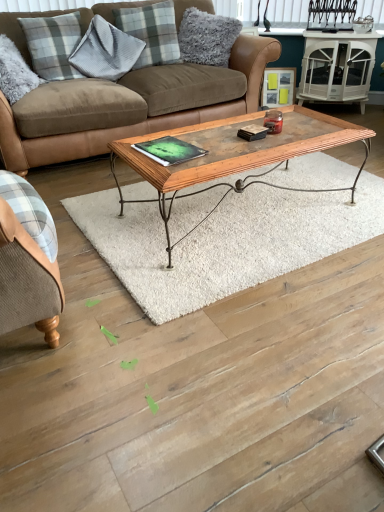
Question: Is brown leather couch at center at the right side of matte wooden picture frame at upper right?

Choices:
 (A) yes
 (B) no

Answer: (B)

Question: From the image's perspective, is brown leather couch at center located above matte wooden picture frame at upper right?

Choices:
 (A) no
 (B) yes

Answer: (A)

Question: Is matte wooden picture frame at upper right at the back of brown leather couch at center?

Choices:
 (A) no
 (B) yes

Answer: (A)

Question: Could you tell me if brown leather couch at center is facing matte wooden picture frame at upper right?

Choices:
 (A) yes
 (B) no

Answer: (B)

Question: Does brown leather couch at center have a greater width compared to matte wooden picture frame at upper right?

Choices:
 (A) no
 (B) yes

Answer: (B)

Question: From the image's perspective, is green matte book at center located above or below gray plaid pillow at upper left, which is counted as the third pillow, starting from the left?

Choices:
 (A) above
 (B) below

Answer: (B)

Question: Based on their sizes in the image, would you say green matte book at center is bigger or smaller than gray plaid pillow at upper left, which appears as the 2th pillow when viewed from the right?

Choices:
 (A) small
 (B) big

Answer: (A)

Question: Which is correct: green matte book at center is inside gray plaid pillow at upper left, which is counted as the third pillow, starting from the left, or outside of it?

Choices:
 (A) inside
 (B) outside

Answer: (B)

Question: Does point (178, 154) appear closer or farther from the camera than point (178, 56)?

Choices:
 (A) farther
 (B) closer

Answer: (B)

Question: Visually, is brown leather couch at center positioned to the left or to the right of gray plaid pillow at upper left, positioned as the first pillow in left-to-right order?

Choices:
 (A) right
 (B) left

Answer: (A)

Question: Does point (145, 82) appear closer or farther from the camera than point (46, 40)?

Choices:
 (A) closer
 (B) farther

Answer: (B)

Question: Is brown leather couch at center wider or thinner than gray plaid pillow at upper left, positioned as the first pillow in left-to-right order?

Choices:
 (A) thin
 (B) wide

Answer: (B)

Question: Is brown leather couch at center in front of or behind gray plaid pillow at upper left, positioned as the first pillow in left-to-right order, in the image?

Choices:
 (A) front
 (B) behind

Answer: (A)

Question: Relative to white glossy side table at upper right, is fluffy gray pillow at upper center, which appears as the fourth pillow when viewed from the left, in front or behind?

Choices:
 (A) behind
 (B) front

Answer: (B)

Question: Is fluffy gray pillow at upper center, which appears as the fourth pillow when viewed from the left, taller or shorter than white glossy side table at upper right?

Choices:
 (A) tall
 (B) short

Answer: (B)